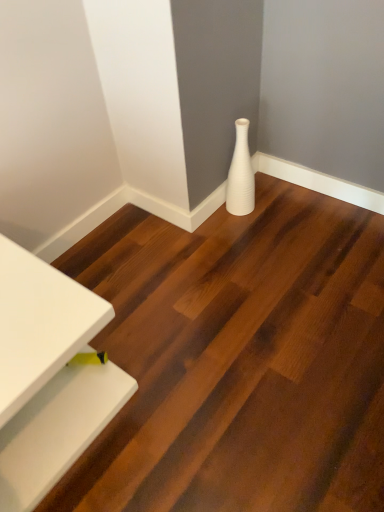
In order to click on empty space that is to the right of white ribbed vase at lower right in this screenshot , I will do `click(283, 204)`.